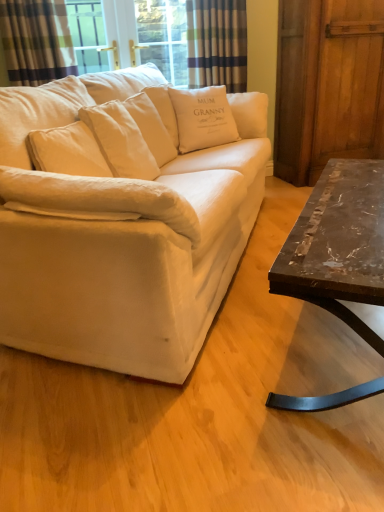
Question: From a real-world perspective, does white cotton couch at center stand above plaid fabric curtain at upper left, which appears as the 2th curtain when viewed from the back?

Choices:
 (A) no
 (B) yes

Answer: (A)

Question: Is white cotton couch at center oriented towards plaid fabric curtain at upper left, placed as the 2th curtain when sorted from right to left?

Choices:
 (A) yes
 (B) no

Answer: (B)

Question: Does white cotton couch at center have a smaller size compared to plaid fabric curtain at upper left, which is the 1th curtain from front to back?

Choices:
 (A) no
 (B) yes

Answer: (A)

Question: Is white cotton couch at center in front of plaid fabric curtain at upper left, the first curtain when ordered from left to right?

Choices:
 (A) no
 (B) yes

Answer: (B)

Question: Is white cotton couch at center next to plaid fabric curtain at upper left, which is the 1th curtain from front to back, and touching it?

Choices:
 (A) no
 (B) yes

Answer: (A)

Question: Is plaid fabric curtain at upper left, which appears as the 2th curtain when viewed from the back, surrounded by white cotton couch at center?

Choices:
 (A) no
 (B) yes

Answer: (A)

Question: Is white cotton couch at center not near marble/black metal coffee table at right?

Choices:
 (A) yes
 (B) no

Answer: (B)

Question: Is white cotton couch at center shorter than marble/black metal coffee table at right?

Choices:
 (A) yes
 (B) no

Answer: (B)

Question: Is white cotton couch at center oriented towards marble/black metal coffee table at right?

Choices:
 (A) yes
 (B) no

Answer: (A)

Question: Can we say white cotton couch at center lies outside marble/black metal coffee table at right?

Choices:
 (A) no
 (B) yes

Answer: (B)

Question: From a real-world perspective, is white cotton couch at center positioned under marble/black metal coffee table at right based on gravity?

Choices:
 (A) no
 (B) yes

Answer: (A)

Question: Is the position of white cotton couch at center less distant than that of marble/black metal coffee table at right?

Choices:
 (A) yes
 (B) no

Answer: (A)

Question: Considering the relative sizes of wooden barn door at right and marble/black metal coffee table at right in the image provided, is wooden barn door at right thinner than marble/black metal coffee table at right?

Choices:
 (A) no
 (B) yes

Answer: (A)